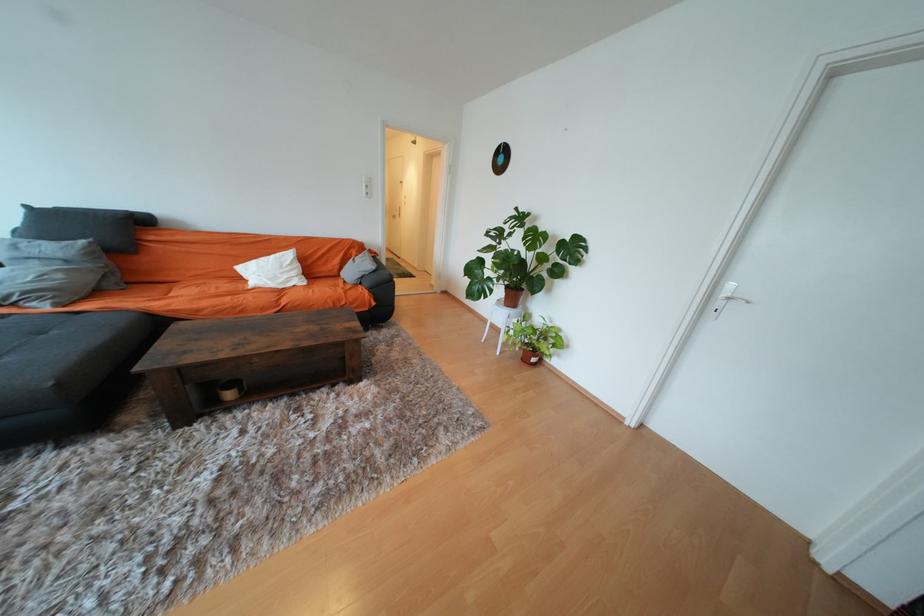
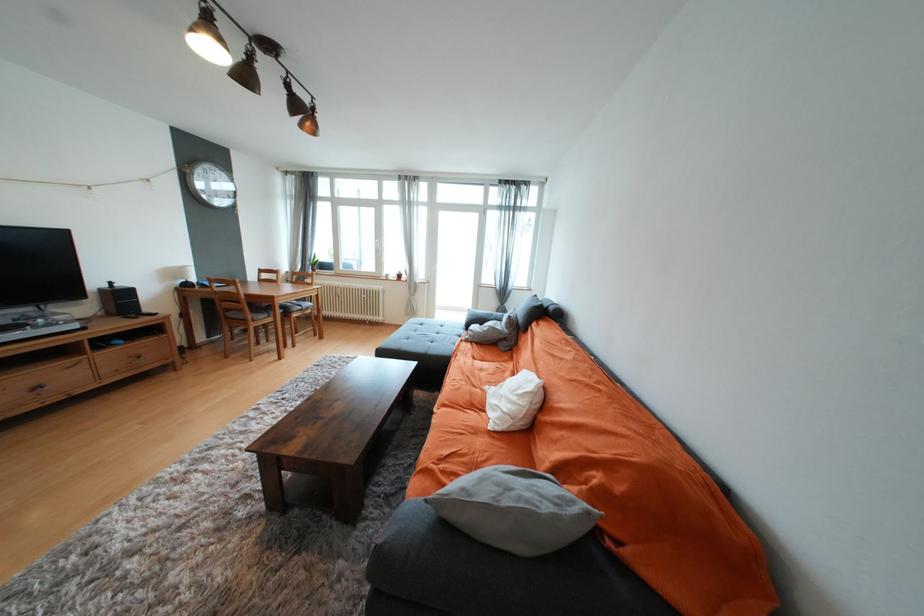
Find the pixel in the second image that matches point 66,277 in the first image.

(492, 330)